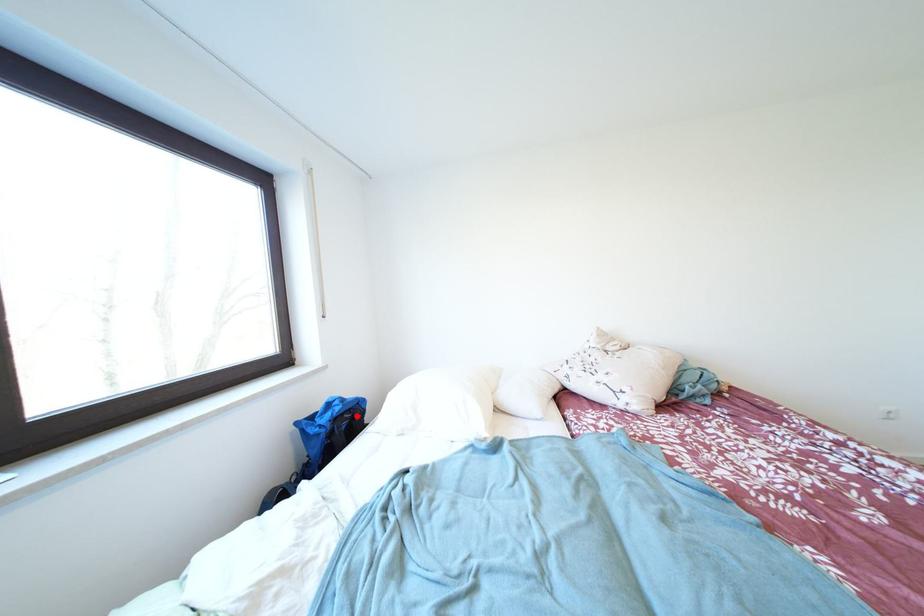
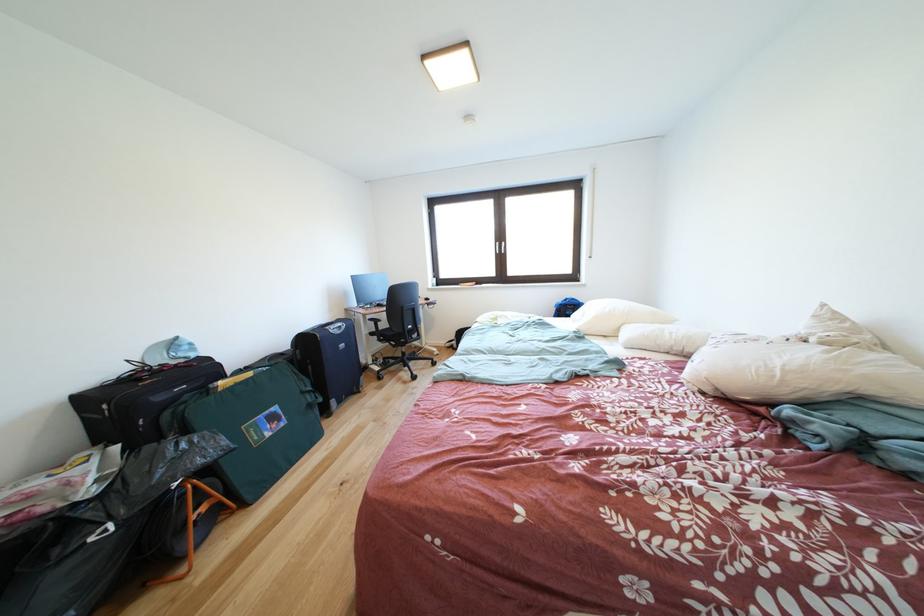
Find the pixel in the second image that matches the highlighted location in the first image.

(578, 310)